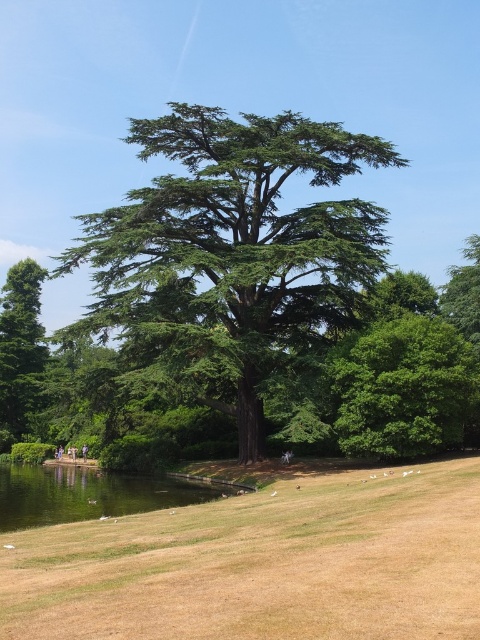
You are standing at the center of the park and looking around. Where is the green textured tree at center located in terms of its 2D coordinates?

→ The green textured tree at center is located at the 2D coordinates of point (x=232, y=252).

You are standing in the park and see the green leafy tree at center and the brown leather jacket at center. Which object is closer to you?

The green leafy tree at center is closer to you because it is in front of the brown leather jacket at center.

You are standing in the park and notice the green textured tree at center and the brown leather jacket at center. Which object appears wider from your current viewpoint?

The green textured tree at center appears wider than the brown leather jacket at center because its width surpasses the jacket.